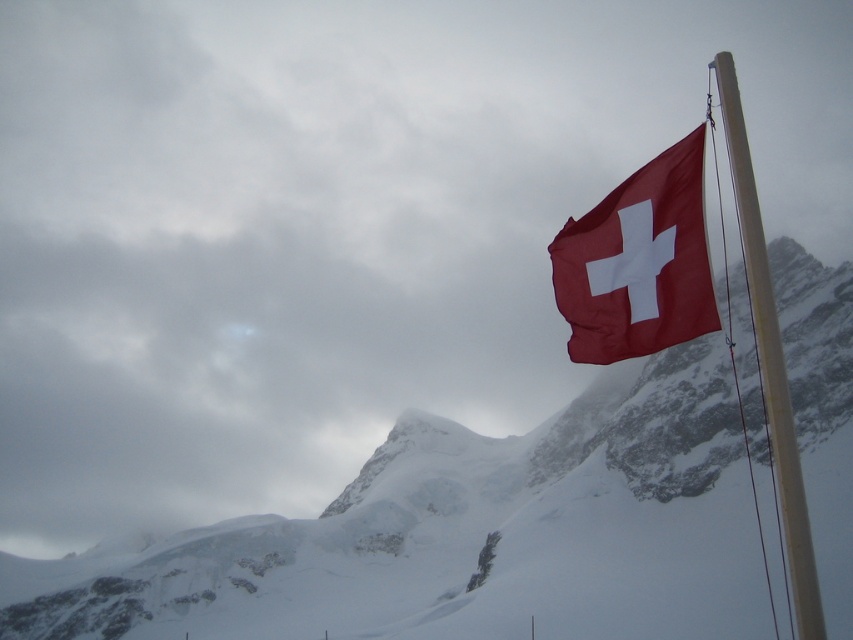
Question: From the image, what is the correct spatial relationship of snowy rock at upper right in relation to matte red flag at upper right?

Choices:
 (A) above
 (B) below

Answer: (B)

Question: Considering the relative positions of matte red flag at upper right and white plastic flag pole at upper right in the image provided, where is matte red flag at upper right located with respect to white plastic flag pole at upper right?

Choices:
 (A) above
 (B) below

Answer: (A)

Question: Which of the following is the closest to the observer?

Choices:
 (A) white plastic flag pole at upper right
 (B) matte red flag at upper right

Answer: (A)

Question: Which point is closer to the camera?

Choices:
 (A) (796, 502)
 (B) (622, 308)
 (C) (651, 634)

Answer: (A)

Question: Which point is farther from the camera taking this photo?

Choices:
 (A) (654, 168)
 (B) (820, 339)

Answer: (B)

Question: Is snowy rock at upper right closer to camera compared to white plastic flag pole at upper right?

Choices:
 (A) yes
 (B) no

Answer: (B)